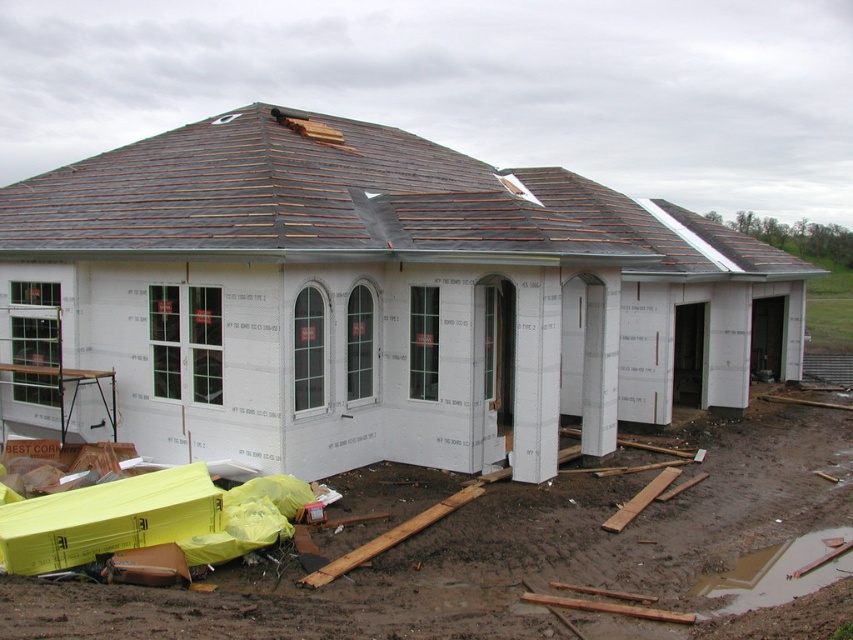
Is white foam insulation at center positioned in front of shiny brown shingles at upper center?

Yes, it is in front of shiny brown shingles at upper center.

Who is more forward, [437,228] or [432,170]?

Point [437,228] is in front.

Find the location of `white foam insulation at center`. white foam insulation at center is located at coordinates (380, 298).

Locate an element on the screen. Image resolution: width=853 pixels, height=640 pixels. white foam insulation at center is located at coordinates (380, 298).